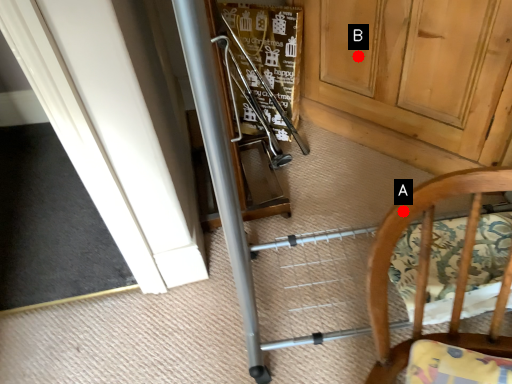
Question: Two points are circled on the image, labeled by A and B beside each circle. Which of the following is the farthest from the observer?

Choices:
 (A) A is further
 (B) B is further

Answer: (B)